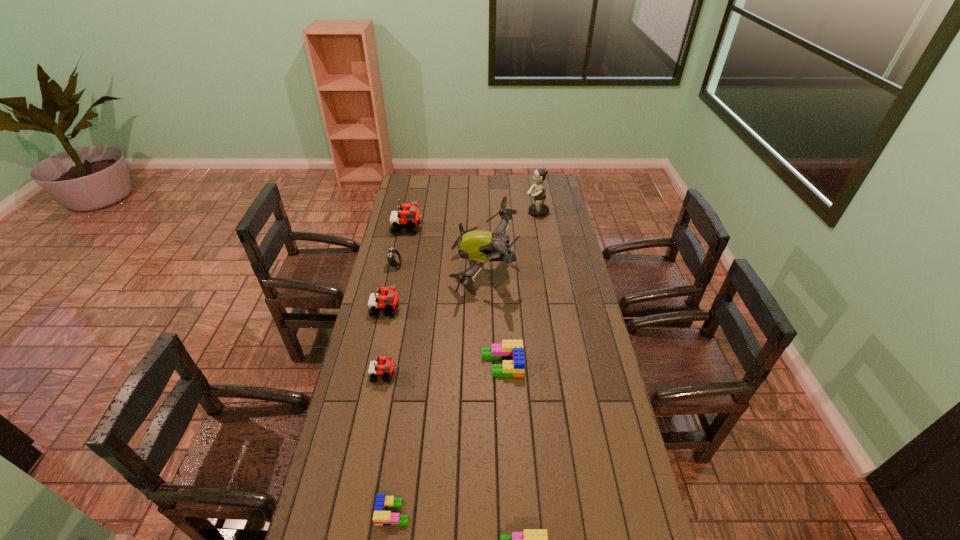
The width and height of the screenshot is (960, 540). What are the coordinates of `the farthest green Lego` in the screenshot? It's located at (511, 352).

The height and width of the screenshot is (540, 960). Find the location of `the fourth tallest Lego`. the fourth tallest Lego is located at coordinates (511, 352).

Find the location of a particular element. The width and height of the screenshot is (960, 540). the shortest object is located at coordinates (381, 517).

In order to click on the second nearest object in this screenshot , I will do `click(381, 517)`.

This screenshot has width=960, height=540. In order to click on vacant space situated 0.110m on the front-facing side of the green drone in this screenshot , I will do `click(426, 271)`.

At what (x,y) coordinates should I click in order to perform the action: click on vacant position located on the front-facing side of the green drone. Please return your answer as a coordinate pair (x, y). This screenshot has height=540, width=960. Looking at the image, I should click on (424, 271).

Where is `vacant region located 0.050m on the front-facing side of the green drone`? The image size is (960, 540). vacant region located 0.050m on the front-facing side of the green drone is located at coordinates point(440,271).

The height and width of the screenshot is (540, 960). I want to click on free point located on the front-facing side of the figurine, so click(459, 212).

Find the location of `free space located on the front-facing side of the figurine`. free space located on the front-facing side of the figurine is located at coordinates (484, 212).

The image size is (960, 540). In order to click on vacant region located 0.340m on the front-facing side of the figurine in this screenshot , I will do `click(461, 212)`.